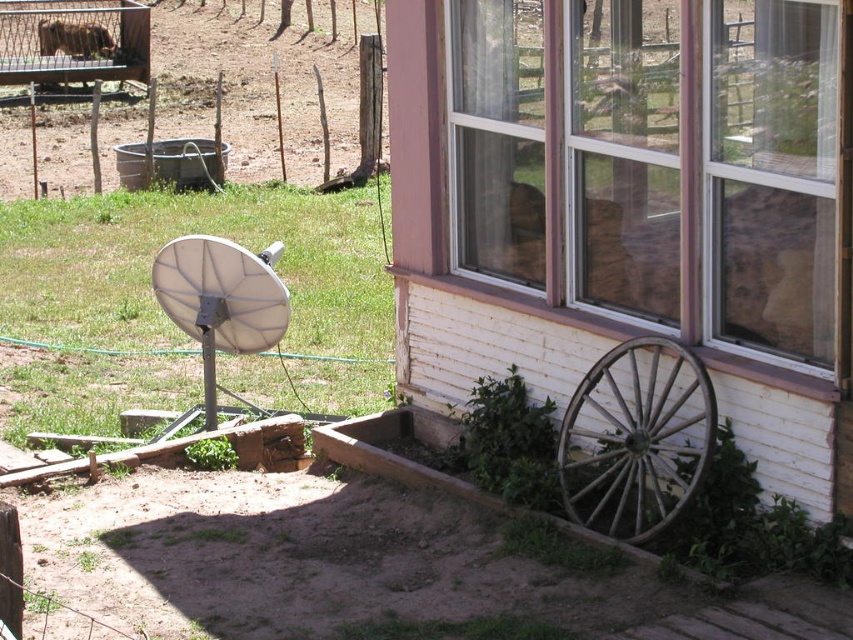
Who is shorter, weathered wood wagon wheel at lower right or brown wooden wagon at upper left?

With less height is weathered wood wagon wheel at lower right.

Which is behind, point (654, 355) or point (44, 29)?

The point (44, 29) is behind.

You are a GUI agent. You are given a task and a screenshot of the screen. Output one action in this format:
    pyautogui.click(x=<x>, y=<y>)
    Task: Click on the weathered wood wagon wheel at lower right
    
    Given the screenshot: What is the action you would take?
    pyautogui.click(x=636, y=438)

Does weathered wood wagon wheel at lower right come in front of white matte satellite dish at left?

Yes.

Does weathered wood wagon wheel at lower right come behind white matte satellite dish at left?

No, weathered wood wagon wheel at lower right is in front of white matte satellite dish at left.

Which is behind, point (694, 376) or point (280, 337)?

The point (280, 337) is behind.

Identify the location of weathered wood wagon wheel at lower right. (636, 438).

Describe the element at coordinates (666, 163) in the screenshot. This screenshot has width=853, height=640. I see `clear glass window at lower right` at that location.

Who is shorter, clear glass window at lower right or white matte satellite dish at left?

white matte satellite dish at left

Between point (782, 198) and point (228, 348), which one is positioned behind?

Point (228, 348)

The width and height of the screenshot is (853, 640). I want to click on clear glass window at lower right, so click(x=666, y=163).